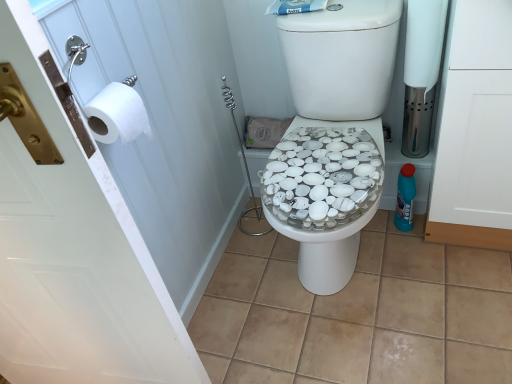
You are a GUI agent. You are given a task and a screenshot of the screen. Output one action in this format:
    pyautogui.click(x=<x>, y=<y>)
    Task: Click on the white paper at left, marked as the first screen door in a left-to-right arrangement
    The width and height of the screenshot is (512, 384).
    Given the screenshot: What is the action you would take?
    167,126

You are a GUI agent. You are given a task and a screenshot of the screen. Output one action in this format:
    pyautogui.click(x=<x>, y=<y>)
    Task: Click on the white matte toilet paper at right, the first toilet paper when ordered from back to front
    The height and width of the screenshot is (384, 512).
    Given the screenshot: What is the action you would take?
    pyautogui.click(x=424, y=42)

What do you see at coordinates (405, 198) in the screenshot? I see `blue plastic bottle at right` at bounding box center [405, 198].

What is the approximate width of white matte cabinet at right, which appears as the 1th screen door when viewed from the right?

white matte cabinet at right, which appears as the 1th screen door when viewed from the right, is 38.17 centimeters wide.

What do you see at coordinates (475, 131) in the screenshot? I see `white matte cabinet at right, marked as the 2th screen door in a left-to-right arrangement` at bounding box center [475, 131].

At what (x,y) coordinates should I click in order to perform the action: click on beige tile at center. Please return your answer as a coordinate pair (x, y). The height and width of the screenshot is (384, 512). Looking at the image, I should click on (358, 314).

How different are the orientations of blue plastic bottle at right and white matte toilet paper at right, placed as the 2th toilet paper when sorted from front to back, in degrees?

The angle between the facing direction of blue plastic bottle at right and the facing direction of white matte toilet paper at right, placed as the 2th toilet paper when sorted from front to back, is 0.00454 degrees.

Considering the sizes of objects blue plastic bottle at right and white matte toilet paper at right, acting as the 1th toilet paper starting from the top, in the image provided, who is thinner, blue plastic bottle at right or white matte toilet paper at right, acting as the 1th toilet paper starting from the top,?

blue plastic bottle at right is thinner.

Who is taller, blue plastic bottle at right or white matte toilet paper at right, the first toilet paper when ordered from back to front?

white matte toilet paper at right, the first toilet paper when ordered from back to front, is taller.

Are blue plastic bottle at right and white matte toilet paper at right, the second toilet paper positioned from the bottom, far apart?

No.

Is white matte toilet paper at right, acting as the 1th toilet paper starting from the right, not inside white paper at left, which appears as the second screen door when viewed from the right?

white matte toilet paper at right, acting as the 1th toilet paper starting from the right, lies outside white paper at left, which appears as the second screen door when viewed from the right,'s area.

Who is taller, white matte toilet paper at right, positioned as the second toilet paper in left-to-right order, or white paper at left, marked as the first screen door in a left-to-right arrangement?

white paper at left, marked as the first screen door in a left-to-right arrangement.

From the image's perspective, is white matte toilet paper at right, placed as the 2th toilet paper when sorted from front to back, under white paper at left, marked as the first screen door in a left-to-right arrangement?

No, from the image's perspective, white matte toilet paper at right, placed as the 2th toilet paper when sorted from front to back, is not below white paper at left, marked as the first screen door in a left-to-right arrangement.

Which is behind, point (409, 222) or point (124, 118)?

Point (409, 222)

Based on their sizes in the image, would you say blue plastic bottle at right is bigger or smaller than white matte toilet paper at left, the 2th toilet paper viewed from the right?

Considering their sizes, blue plastic bottle at right takes up more space than white matte toilet paper at left, the 2th toilet paper viewed from the right.

How different are the orientations of blue plastic bottle at right and white matte toilet paper at left, which ranks as the 1th toilet paper in left-to-right order, in degrees?

90.1 degrees separate the facing orientations of blue plastic bottle at right and white matte toilet paper at left, which ranks as the 1th toilet paper in left-to-right order.

From a real-world perspective, who is located higher, beige tile at center or white matte toilet paper at left, placed as the second toilet paper when sorted from back to front?

white matte toilet paper at left, placed as the second toilet paper when sorted from back to front.

Does beige tile at center turn towards white matte toilet paper at left, the 2th toilet paper viewed from the right?

No, beige tile at center does not turn towards white matte toilet paper at left, the 2th toilet paper viewed from the right.

Based on the photo, between beige tile at center and white matte toilet paper at left, the first toilet paper when ordered from front to back, which one has smaller size?

With smaller size is white matte toilet paper at left, the first toilet paper when ordered from front to back.

Considering the relative sizes of white matte toilet paper at left, the 2th toilet paper viewed from the right, and white matte toilet paper at right, the second toilet paper positioned from the bottom, in the image provided, is white matte toilet paper at left, the 2th toilet paper viewed from the right, wider than white matte toilet paper at right, the second toilet paper positioned from the bottom,?

Incorrect, the width of white matte toilet paper at left, the 2th toilet paper viewed from the right, does not surpass that of white matte toilet paper at right, the second toilet paper positioned from the bottom.

Is white matte toilet paper at left, the second toilet paper in the top-to-bottom sequence, inside the boundaries of white matte toilet paper at right, acting as the 1th toilet paper starting from the top, or outside?

white matte toilet paper at left, the second toilet paper in the top-to-bottom sequence, is outside white matte toilet paper at right, acting as the 1th toilet paper starting from the top.

In the scene shown: Based on their sizes in the image, would you say white matte toilet paper at left, the 2th toilet paper viewed from the right, is bigger or smaller than white matte toilet paper at right, the second toilet paper positioned from the bottom?

In the image, white matte toilet paper at left, the 2th toilet paper viewed from the right, appears to be smaller than white matte toilet paper at right, the second toilet paper positioned from the bottom.

From a real-world perspective, is white matte toilet paper at left, the first toilet paper when ordered from front to back, physically above white matte toilet paper at right, placed as the 2th toilet paper when sorted from front to back?

Yes, from a real-world perspective, white matte toilet paper at left, the first toilet paper when ordered from front to back, is on top of white matte toilet paper at right, placed as the 2th toilet paper when sorted from front to back.

Is beige tile at center at the back of blue plastic bottle at right?

No.

Choose the correct answer: Is blue plastic bottle at right inside beige tile at center or outside it?

blue plastic bottle at right is outside beige tile at center.

Locate an element on the screen. The height and width of the screenshot is (384, 512). tile that is under the blue plastic bottle at right (from a real-world perspective) is located at coordinates [x=358, y=314].

Based on the photo, from a real-world perspective, between blue plastic bottle at right and beige tile at center, who is vertically lower?

From a 3D spatial view, beige tile at center is below.

Is white matte cabinet at right, marked as the 2th screen door in a left-to-right arrangement, surrounding white matte toilet paper at right, positioned as the second toilet paper in left-to-right order?

Definitely not — white matte toilet paper at right, positioned as the second toilet paper in left-to-right order, is not inside white matte cabinet at right, marked as the 2th screen door in a left-to-right arrangement.

Is white matte cabinet at right, marked as the 2th screen door in a left-to-right arrangement, wider than white matte toilet paper at right, acting as the 1th toilet paper starting from the top?

Indeed, white matte cabinet at right, marked as the 2th screen door in a left-to-right arrangement, has a greater width compared to white matte toilet paper at right, acting as the 1th toilet paper starting from the top.

Does white matte cabinet at right, which appears as the 1th screen door when viewed from the right, have a lesser height compared to white matte toilet paper at right, placed as the 2th toilet paper when sorted from front to back?

No, white matte cabinet at right, which appears as the 1th screen door when viewed from the right, is not shorter than white matte toilet paper at right, placed as the 2th toilet paper when sorted from front to back.

From a real-world perspective, between white matte cabinet at right, which appears as the 1th screen door when viewed from the right, and white matte toilet paper at right, the second toilet paper positioned from the bottom, who is vertically higher?

white matte toilet paper at right, the second toilet paper positioned from the bottom.

You are a GUI agent. You are given a task and a screenshot of the screen. Output one action in this format:
    pyautogui.click(x=<x>, y=<y>)
    Task: Click on the bottle lying on the right of white matte toilet paper at right, the first toilet paper when ordered from back to front
    This screenshot has width=512, height=384.
    Given the screenshot: What is the action you would take?
    pyautogui.click(x=405, y=198)

Locate an element on the screen. screen door lying on the left of white matte toilet paper at right, placed as the 2th toilet paper when sorted from front to back is located at coordinates (167, 126).

Estimate the real-world distances between objects in this image. Which object is further from white matte cabinet at right, which appears as the 1th screen door when viewed from the right, beige tile at center or white paper at left, marked as the first screen door in a left-to-right arrangement?

Among the two, white paper at left, marked as the first screen door in a left-to-right arrangement, is located further to white matte cabinet at right, which appears as the 1th screen door when viewed from the right.

Looking at the image, which one is located closer to white matte cabinet at right, marked as the 2th screen door in a left-to-right arrangement, white paper at left, marked as the first screen door in a left-to-right arrangement, or white matte toilet paper at right, positioned as the second toilet paper in left-to-right order?

white matte toilet paper at right, positioned as the second toilet paper in left-to-right order, is positioned closer to the anchor white matte cabinet at right, marked as the 2th screen door in a left-to-right arrangement.

Considering their positions, is beige tile at center positioned closer to blue plastic bottle at right than white matte toilet paper at left, the 2th toilet paper viewed from the right?

Among the two, beige tile at center is located nearer to blue plastic bottle at right.

When comparing their distances from white matte cabinet at right, marked as the 2th screen door in a left-to-right arrangement, does white paper at left, which appears as the second screen door when viewed from the right, or blue plastic bottle at right seem further?

white paper at left, which appears as the second screen door when viewed from the right.

Based on their spatial positions, is white matte toilet paper at right, the second toilet paper positioned from the bottom, or beige tile at center further from white matte toilet paper at left, the first toilet paper when ordered from front to back?

The object further to white matte toilet paper at left, the first toilet paper when ordered from front to back, is beige tile at center.

Which object lies further to the anchor point blue plastic bottle at right, white matte toilet paper at right, acting as the 1th toilet paper starting from the top, or white paper at left, marked as the first screen door in a left-to-right arrangement?

white paper at left, marked as the first screen door in a left-to-right arrangement, is further to blue plastic bottle at right.

Looking at the image, which one is located closer to beige tile at center, white matte toilet paper at right, placed as the 2th toilet paper when sorted from front to back, or blue plastic bottle at right?

blue plastic bottle at right lies closer to beige tile at center than the other object.

Which object lies nearer to the anchor point white matte cabinet at right, marked as the 2th screen door in a left-to-right arrangement, blue plastic bottle at right or white paper at left, which appears as the second screen door when viewed from the right?

blue plastic bottle at right is positioned closer to the anchor white matte cabinet at right, marked as the 2th screen door in a left-to-right arrangement.

Find the location of a particular element. The height and width of the screenshot is (384, 512). tile between white matte toilet paper at left, placed as the second toilet paper when sorted from back to front, and blue plastic bottle at right, in the horizontal direction is located at coordinates (358, 314).

Find the location of a particular element. The height and width of the screenshot is (384, 512). screen door located between white matte toilet paper at left, which ranks as the 1th toilet paper in left-to-right order, and white matte toilet paper at right, the first toilet paper when ordered from back to front, in the left-right direction is located at coordinates (167, 126).

Where is `toilet paper located between white paper at left, which appears as the second screen door when viewed from the right, and blue plastic bottle at right in the left-right direction`? Image resolution: width=512 pixels, height=384 pixels. toilet paper located between white paper at left, which appears as the second screen door when viewed from the right, and blue plastic bottle at right in the left-right direction is located at coordinates (424, 42).

Locate an element on the screen. tile between white paper at left, which appears as the second screen door when viewed from the right, and blue plastic bottle at right, along the z-axis is located at coordinates (358, 314).